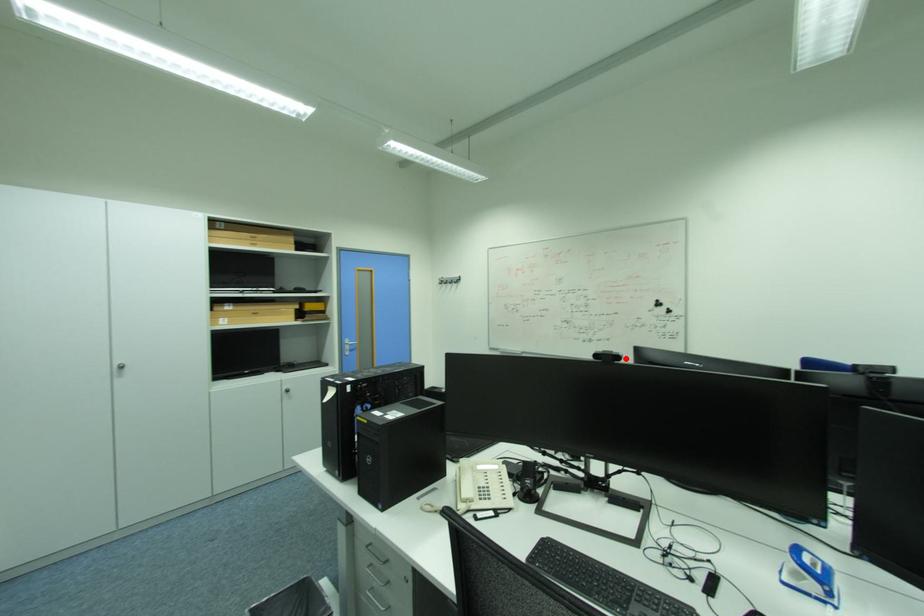
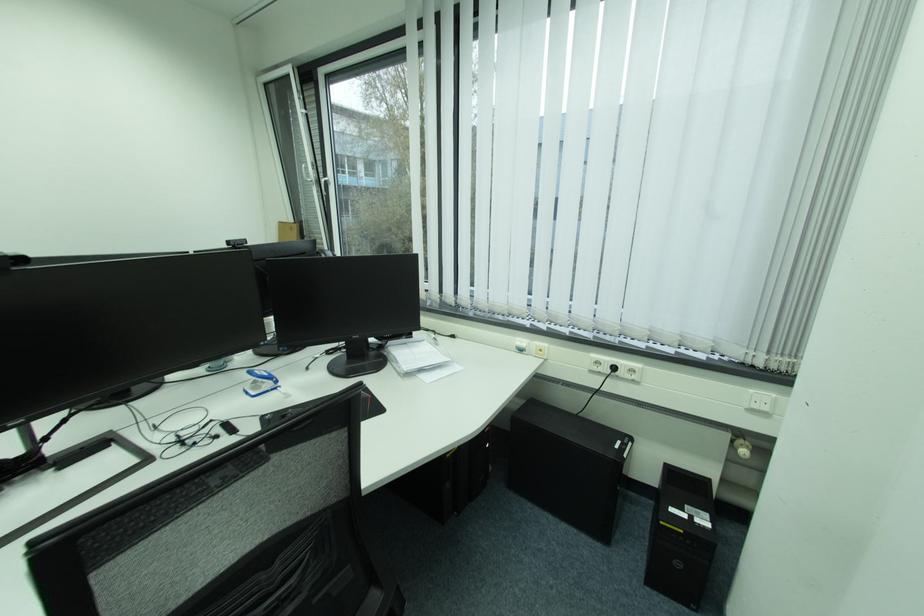
Question: I am providing you with two images of the same scene from different viewpoints. A red point is marked on the first image. Is the red point's position out of view in image 2?

Choices:
 (A) Yes
 (B) No

Answer: (B)